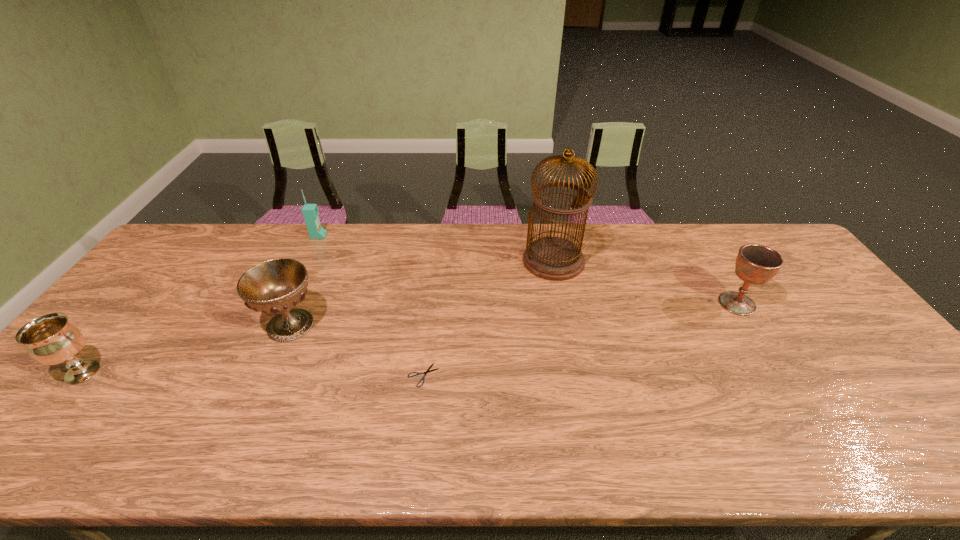
Identify which object is the second nearest to the birdcage. Please provide its 2D coordinates. Your answer should be formatted as a tuple, i.e. [(x, y)], where the tuple contains the x and y coordinates of a point satisfying the conditions above.

[(418, 373)]

Select which chalice is the closest to the shortest object. Please provide its 2D coordinates. Your answer should be formatted as a tuple, i.e. [(x, y)], where the tuple contains the x and y coordinates of a point satisfying the conditions above.

[(276, 286)]

Where is `chalice identified as the third closest to the cellular telephone`? The image size is (960, 540). chalice identified as the third closest to the cellular telephone is located at coordinates (756, 264).

The width and height of the screenshot is (960, 540). Identify the location of vacant space that satisfies the following two spatial constraints: 1. on the back side of the rightmost object; 2. on the left side of the nearest chalice. (139, 303).

Image resolution: width=960 pixels, height=540 pixels. Identify the location of free spot that satisfies the following two spatial constraints: 1. on the keypad of the farthest object; 2. on the left side of the shears. (253, 375).